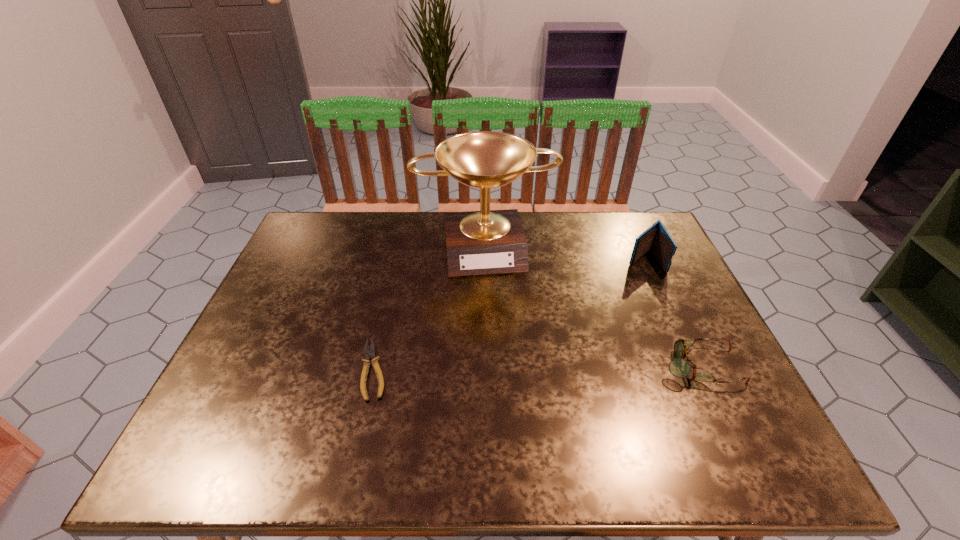
At what (x,y) coordinates should I click in order to perform the action: click on free location located on the front-facing side of the second object from left to right. Please return your answer as a coordinate pair (x, y). Looking at the image, I should click on (506, 352).

I want to click on free space located on the front-facing side of the second object from left to right, so click(496, 299).

Locate an element on the screen. The width and height of the screenshot is (960, 540). blank area located on the front-facing side of the second object from left to right is located at coordinates (508, 362).

Locate an element on the screen. The height and width of the screenshot is (540, 960). wallet situated at the far edge is located at coordinates (656, 237).

Where is `award that is positioned at the far edge`? award that is positioned at the far edge is located at coordinates (488, 241).

At what (x,y) coordinates should I click in order to perform the action: click on pliers present at the near edge. Please return your answer as a coordinate pair (x, y). Image resolution: width=960 pixels, height=540 pixels. Looking at the image, I should click on (370, 353).

The image size is (960, 540). Identify the location of spectacles situated at the near edge. (679, 367).

Identify the location of spectacles that is at the right edge. This screenshot has height=540, width=960. (679, 367).

I want to click on wallet present at the right edge, so click(x=656, y=237).

In order to click on object present at the far right corner in this screenshot , I will do `click(656, 237)`.